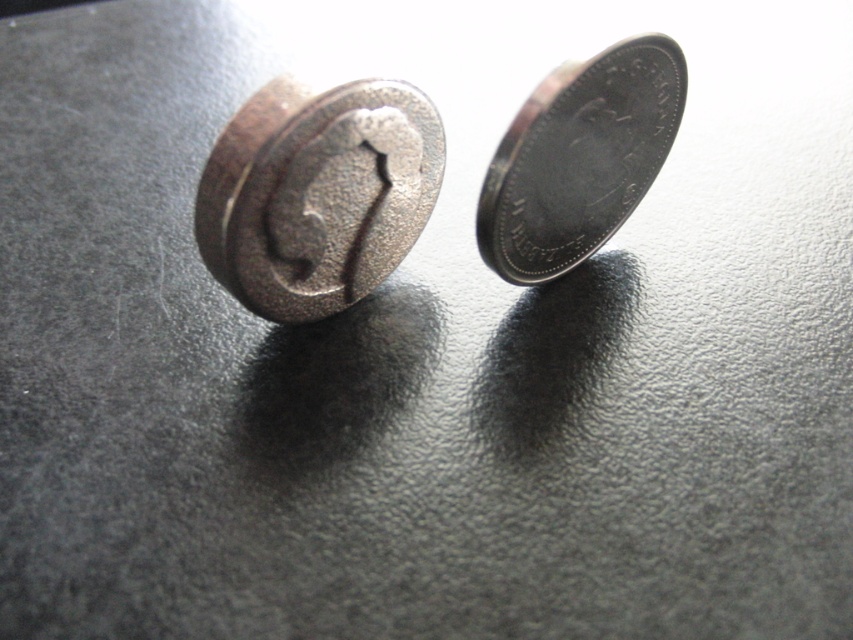
Can you confirm if rusty metal coin at center is smaller than silver metallic coin at upper right?

No.

What do you see at coordinates (317, 193) in the screenshot? I see `rusty metal coin at center` at bounding box center [317, 193].

Where is `rusty metal coin at center`? rusty metal coin at center is located at coordinates (317, 193).